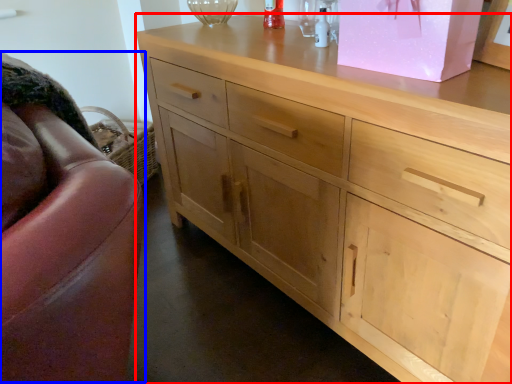
Question: Which object is closer to the camera taking this photo, chest of drawers (highlighted by a red box) or swivel chair (highlighted by a blue box)?

Choices:
 (A) chest of drawers
 (B) swivel chair

Answer: (A)